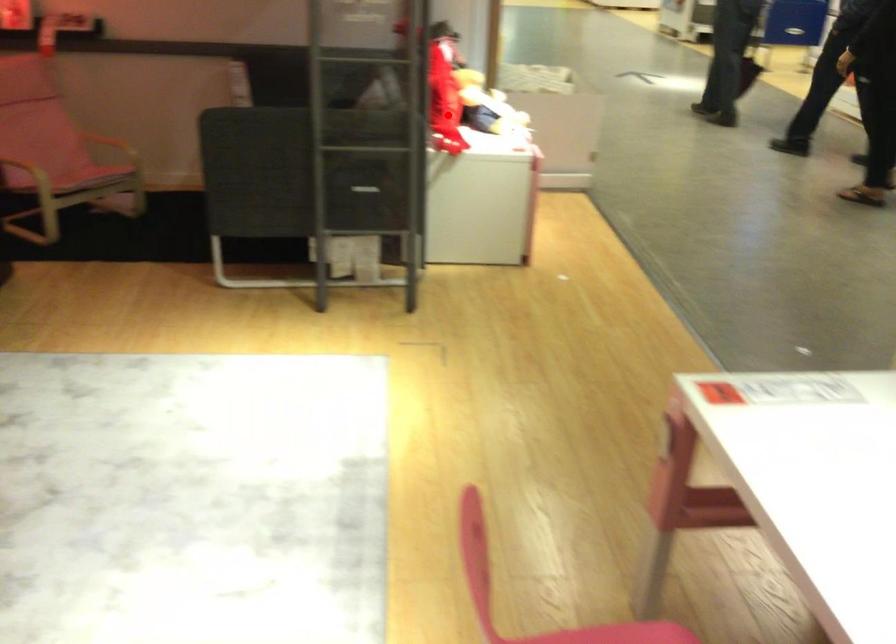
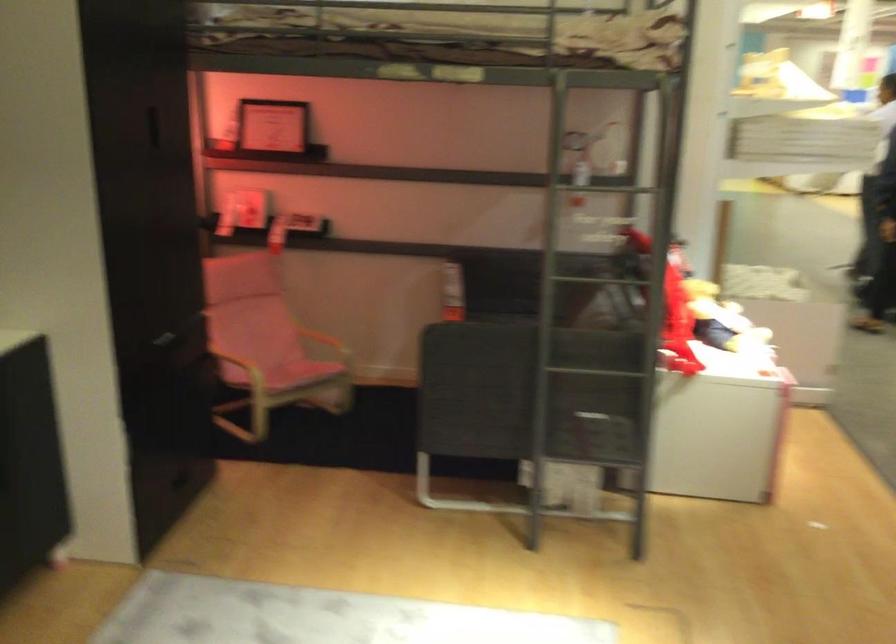
Question: I am providing you with two images of the same scene from different viewpoints. Image1 has a red point marked. In image2, the corresponding 3D location appears at what relative position? Reply with the corresponding letter.

Choices:
 (A) Closer
 (B) Farther

Answer: (A)